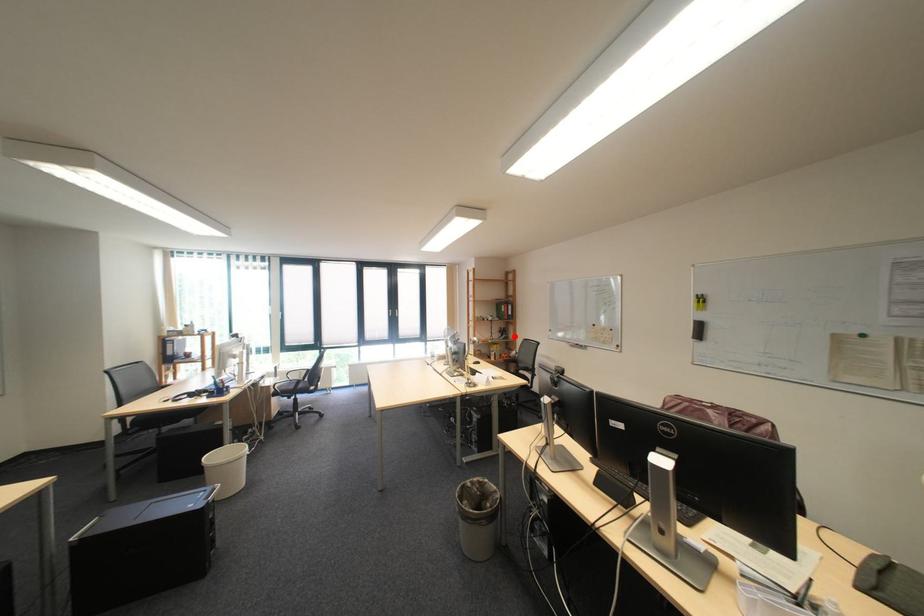
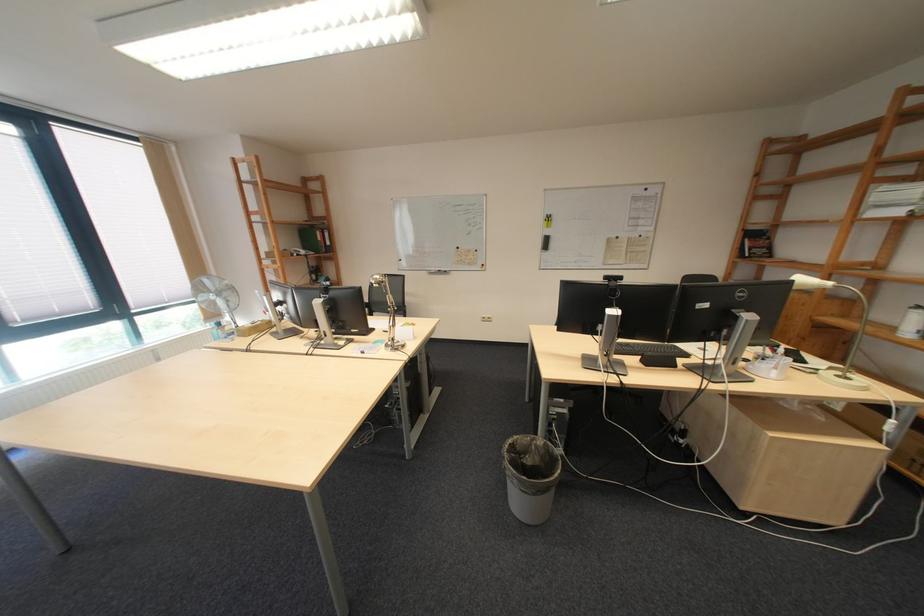
Locate, in the second image, the point that corresponds to the highlighted location in the first image.

(329, 278)